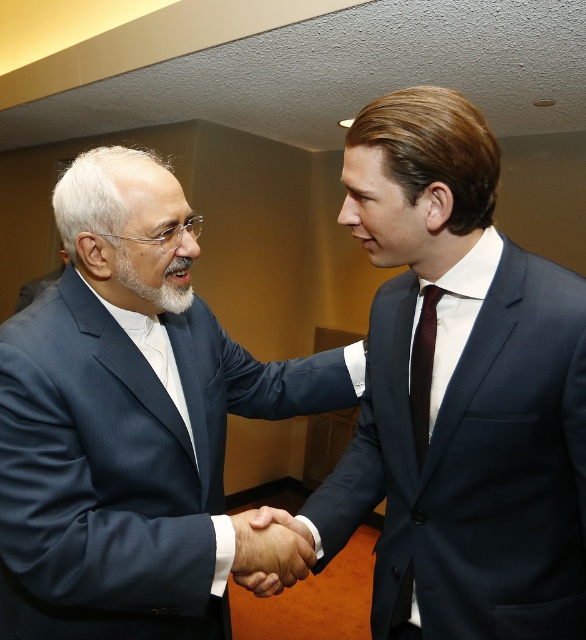
Question: Does dark blue suit at center have a greater width compared to smooth skin handshake at center?

Choices:
 (A) yes
 (B) no

Answer: (A)

Question: Is matte black suit at center further to the viewer compared to dark brown silk tie at center?

Choices:
 (A) no
 (B) yes

Answer: (A)

Question: Among these points, which one is nearest to the camera?

Choices:
 (A) (247, 552)
 (B) (442, 244)

Answer: (A)

Question: Can you confirm if smooth skin handshake at center is positioned below white soft beard at center?

Choices:
 (A) no
 (B) yes

Answer: (B)

Question: Based on their relative distances, which object is nearer to the smooth skin handshake at center?

Choices:
 (A) matte black suit at center
 (B) dark blue suit at center
 (C) dark brown silk tie at center

Answer: (A)

Question: Estimate the real-world distances between objects in this image. Which object is closer to the dark brown silk tie at center?

Choices:
 (A) dark blue suit at center
 (B) smooth skin handshake at center
 (C) matte black suit at center
 (D) white soft beard at center

Answer: (A)